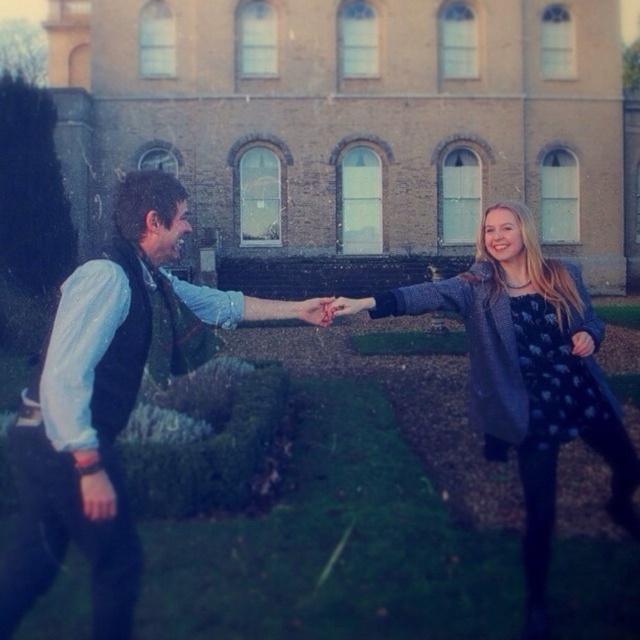
Question: Does sparkly silver dress at center appear over matte black hand at center?

Choices:
 (A) yes
 (B) no

Answer: (A)

Question: Which point appears closest to the camera in this image?

Choices:
 (A) (308, 312)
 (B) (541, 310)
 (C) (12, 589)
 (D) (362, 310)

Answer: (C)

Question: Does matte green vest at left have a larger size compared to sparkly silver dress at center?

Choices:
 (A) no
 (B) yes

Answer: (B)

Question: Does sparkly silver dress at center lie behind matte pink hand at center?

Choices:
 (A) no
 (B) yes

Answer: (A)

Question: Among these points, which one is farthest from the camera?

Choices:
 (A) 536,552
 (B) 342,307

Answer: (B)

Question: Considering the real-world distances, which object is farthest from the matte pink hand at center?

Choices:
 (A) matte green vest at left
 (B) sparkly silver dress at center

Answer: (A)